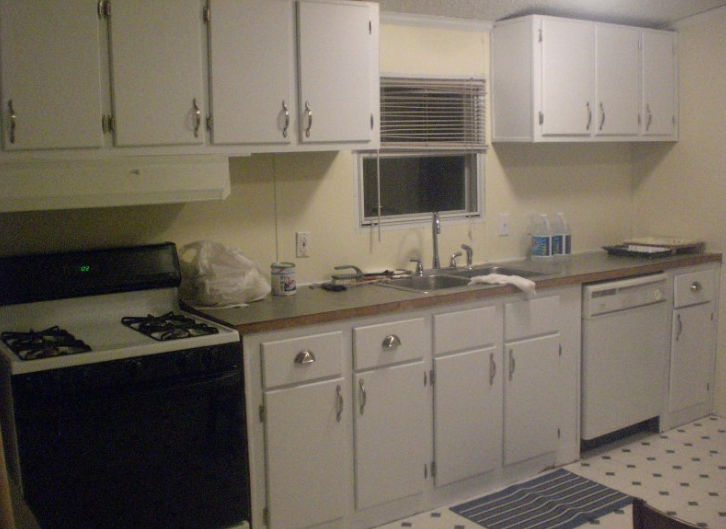
Locate an element on the screen. This screenshot has width=726, height=529. countertop is located at coordinates (303, 302).